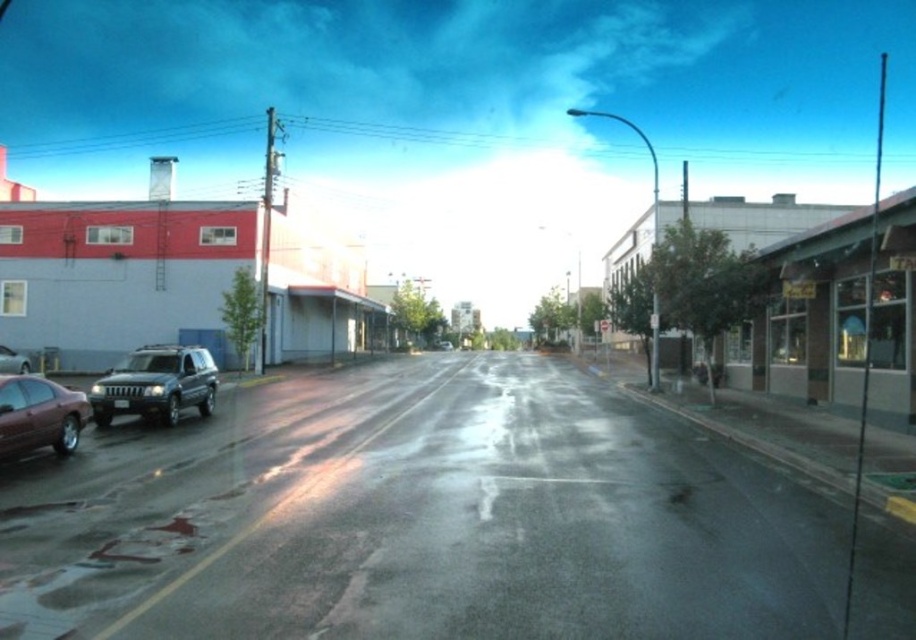
Is point (171, 400) in front of point (72, 396)?

No, it is not.

Locate an element on the screen. Image resolution: width=916 pixels, height=640 pixels. metallic gray suv at left is located at coordinates (156, 385).

Where is `metallic gray suv at left`? This screenshot has height=640, width=916. metallic gray suv at left is located at coordinates (156, 385).

Who is shorter, shiny maroon sedan at lower left or shiny silver sedan at left?

shiny silver sedan at left is shorter.

Which is behind, point (2, 452) or point (27, 362)?

Positioned behind is point (27, 362).

Where is `shiny maroon sedan at lower left`? shiny maroon sedan at lower left is located at coordinates (38, 416).

Can you confirm if metallic gray suv at left is positioned above shiny silver sedan at left?

Correct, metallic gray suv at left is located above shiny silver sedan at left.

Consider the image. Does metallic gray suv at left have a larger size compared to shiny silver sedan at left?

Correct, metallic gray suv at left is larger in size than shiny silver sedan at left.

Describe the element at coordinates (156, 385) in the screenshot. I see `metallic gray suv at left` at that location.

The image size is (916, 640). I want to click on metallic gray suv at left, so click(x=156, y=385).